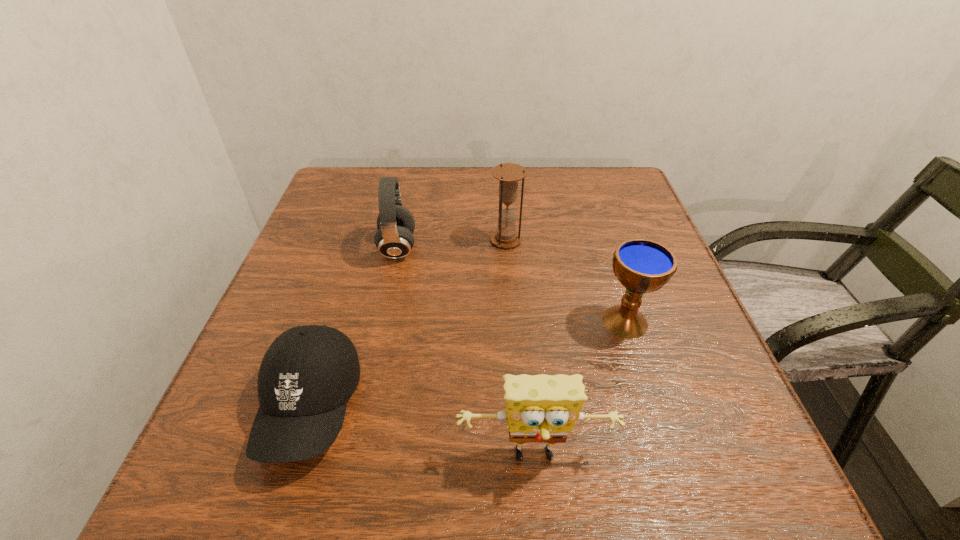
Identify the location of hourglass. (508, 174).

Where is `headset`? The height and width of the screenshot is (540, 960). headset is located at coordinates (394, 239).

Find the location of a particular element. The width and height of the screenshot is (960, 540). sponge is located at coordinates pos(542,408).

Where is `the rightmost object`? The height and width of the screenshot is (540, 960). the rightmost object is located at coordinates (641, 265).

At what (x,y) coordinates should I click in order to perform the action: click on the third farthest object. Please return your answer as a coordinate pair (x, y). The width and height of the screenshot is (960, 540). Looking at the image, I should click on (641, 265).

Where is `baseball cap`? This screenshot has width=960, height=540. baseball cap is located at coordinates (307, 375).

Where is `vacant space located on the left of the hourglass`? The width and height of the screenshot is (960, 540). vacant space located on the left of the hourglass is located at coordinates (403, 240).

This screenshot has height=540, width=960. Identify the location of free region located on the ear cups of the headset. (577, 248).

At what (x,y) coordinates should I click in order to perform the action: click on free spot located 0.170m on the back of the third nearest object. Please return your answer as a coordinate pair (x, y). The image size is (960, 540). Looking at the image, I should click on (601, 247).

Where is `sponge that is positioned at the near edge`? This screenshot has width=960, height=540. sponge that is positioned at the near edge is located at coordinates (542, 408).